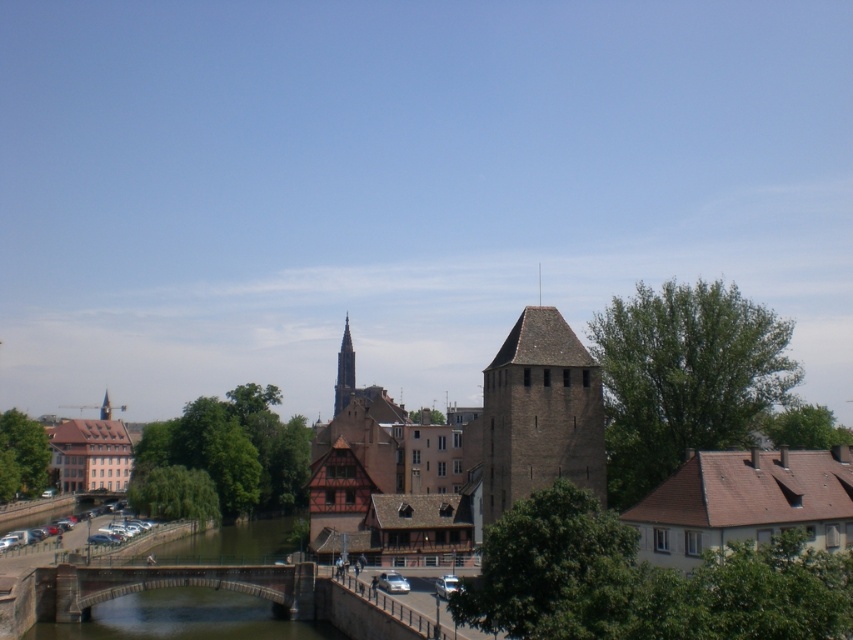
Question: Is brown brick tower at center smaller than concrete stone bridge at lower center?

Choices:
 (A) no
 (B) yes

Answer: (A)

Question: Based on their relative distances, which object is farther from the concrete stone bridge at lower center?

Choices:
 (A) brown brick tower at center
 (B) smooth stone tower at center

Answer: (B)

Question: Among these points, which one is nearest to the camera?

Choices:
 (A) (572, 352)
 (B) (74, 579)
 (C) (344, 336)

Answer: (A)

Question: Does concrete stone bridge at lower center have a larger size compared to smooth stone tower at center?

Choices:
 (A) no
 (B) yes

Answer: (A)

Question: Does brown brick tower at center appear under concrete stone bridge at lower center?

Choices:
 (A) yes
 (B) no

Answer: (B)

Question: Which point appears closest to the camera in this image?

Choices:
 (A) (39, 596)
 (B) (527, 401)
 (C) (341, 368)

Answer: (B)